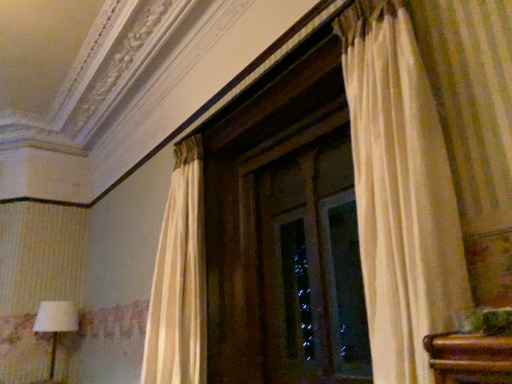
Measure the distance between white fabric lampshade at lower left and camera.

white fabric lampshade at lower left and camera are 4.46 meters apart from each other.

This screenshot has width=512, height=384. What do you see at coordinates (55, 326) in the screenshot?
I see `white fabric lampshade at lower left` at bounding box center [55, 326].

You are a GUI agent. You are given a task and a screenshot of the screen. Output one action in this format:
    pyautogui.click(x=<x>, y=<y>)
    Task: Click on the white fabric lampshade at lower left
    
    Given the screenshot: What is the action you would take?
    pyautogui.click(x=55, y=326)

I want to click on white fabric lampshade at lower left, so click(55, 326).